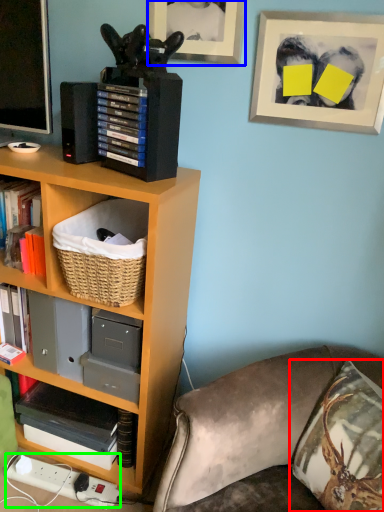
Question: Based on their relative distances, which object is nearer to throw pillow (highlighted by a red box)? Choose from picture frame (highlighted by a blue box) and plug (highlighted by a green box).

Choices:
 (A) picture frame
 (B) plug

Answer: (B)